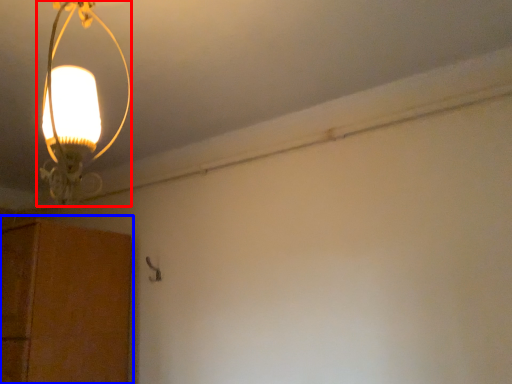
Question: Which object appears closest to the camera in this image, lamp (highlighted by a red box) or cabinetry (highlighted by a blue box)?

Choices:
 (A) lamp
 (B) cabinetry

Answer: (A)